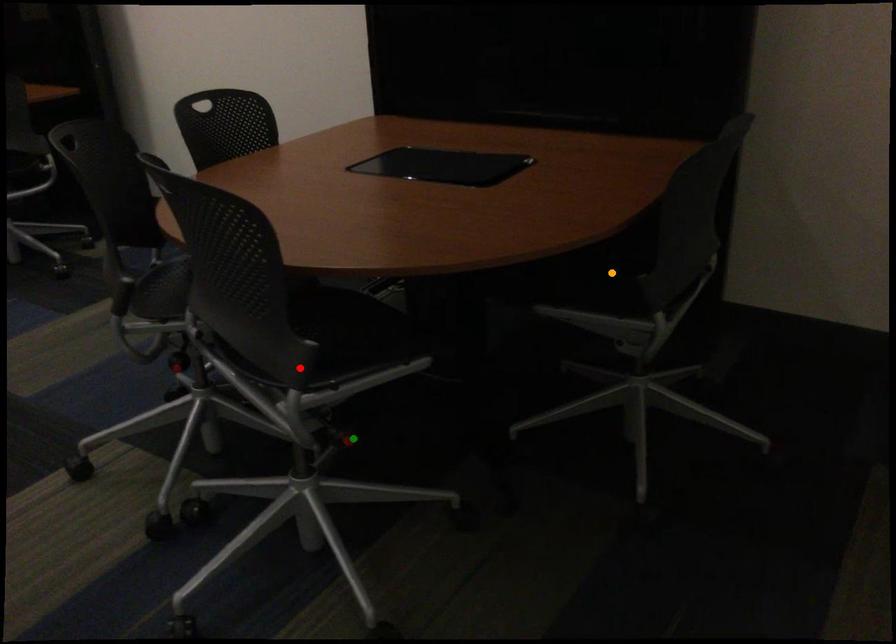
Order these from nearest to farthest:
1. green point
2. red point
3. orange point

green point
orange point
red point